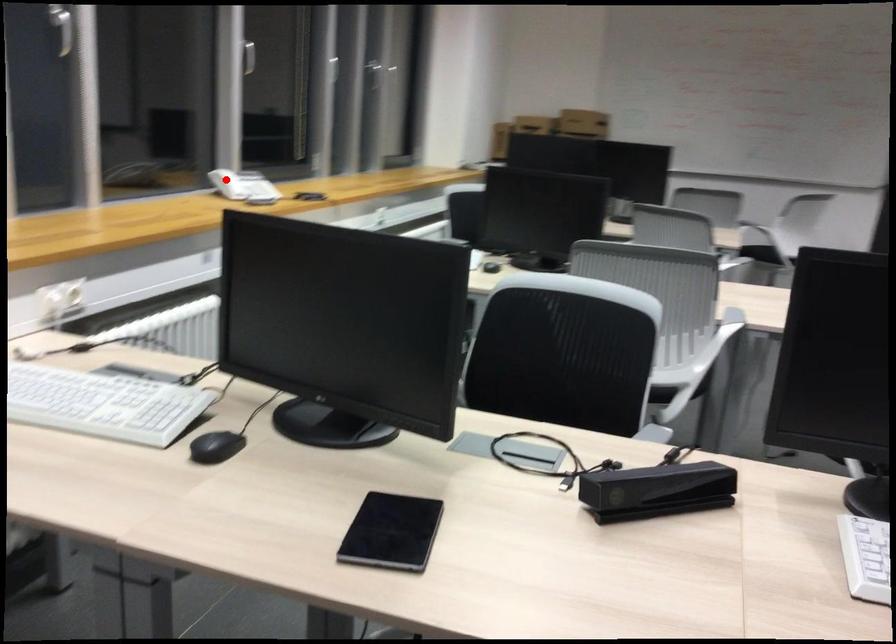
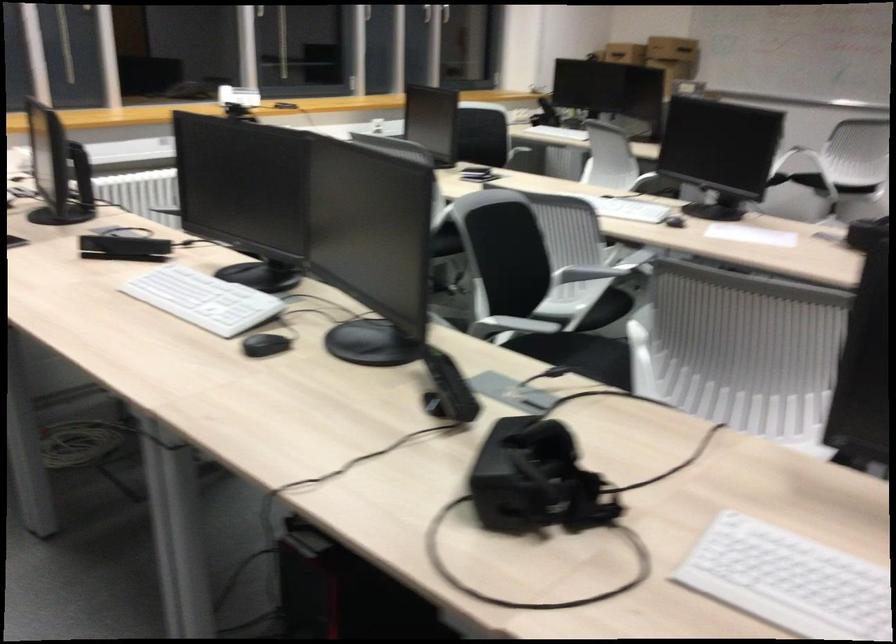
Question: I am providing you with two images of the same scene from different viewpoints. A red point is shown in image1. For the corresponding object point in image2, is it positioned nearer or farther from the camera?

Choices:
 (A) Nearer
 (B) Farther

Answer: (B)